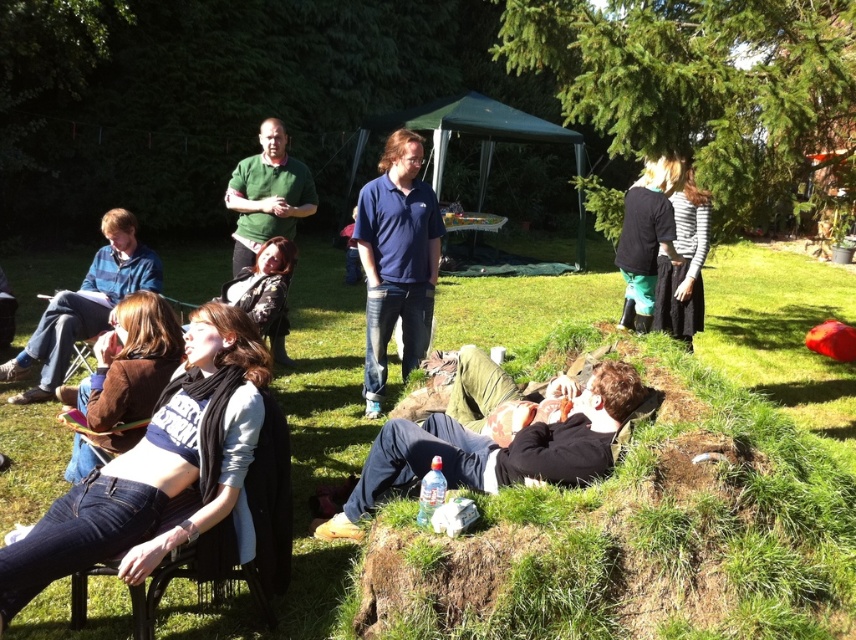
In the scene shown: Between black fabric jacket at right and striped cotton shirt at center, which one has less height?

With less height is black fabric jacket at right.

Does black fabric jacket at right have a greater width compared to striped cotton shirt at center?

Indeed, black fabric jacket at right has a greater width compared to striped cotton shirt at center.

Which is in front, point (648, 180) or point (658, 273)?

Point (658, 273)

Where is `black fabric jacket at right`? black fabric jacket at right is located at coordinates (646, 237).

Does brown sweater at left appear on the right side of striped cotton shirt at center?

In fact, brown sweater at left is to the left of striped cotton shirt at center.

Can you confirm if brown sweater at left is positioned to the left of striped cotton shirt at center?

Indeed, brown sweater at left is positioned on the left side of striped cotton shirt at center.

Where is `brown sweater at left`? The width and height of the screenshot is (856, 640). brown sweater at left is located at coordinates [85, 305].

Identify the location of brown sweater at left. This screenshot has height=640, width=856. (85, 305).

Does brown soft jacket at lower left come in front of striped cotton shirt at center?

Yes, brown soft jacket at lower left is closer to the viewer.

Measure the distance between brown soft jacket at lower left and camera.

brown soft jacket at lower left is 3.33 meters away from camera.

Where is `brown soft jacket at lower left`? The height and width of the screenshot is (640, 856). brown soft jacket at lower left is located at coordinates (131, 362).

At what (x,y) coordinates should I click in order to perform the action: click on brown soft jacket at lower left. Please return your answer as a coordinate pair (x, y). Looking at the image, I should click on (131, 362).